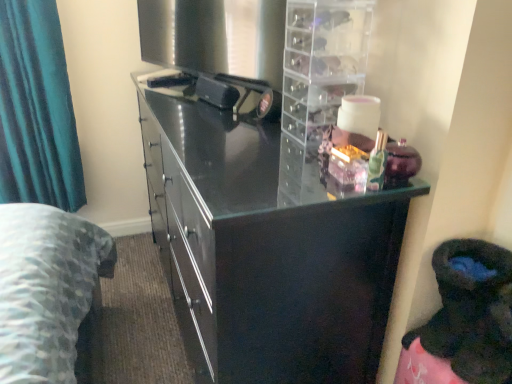
Describe the element at coordinates (266, 246) in the screenshot. I see `glossy black cupboard at center` at that location.

What do you see at coordinates (322, 63) in the screenshot? This screenshot has height=384, width=512. I see `clear plastic drawer unit at upper right` at bounding box center [322, 63].

Locate an element on the screen. teal fabric curtain at left is located at coordinates (37, 110).

From the image's perspective, which object appears higher, glossy black cupboard at center or clear plastic drawer unit at upper right?

clear plastic drawer unit at upper right is shown above in the image.

Could you tell me if glossy black cupboard at center is facing clear plastic drawer unit at upper right?

No, glossy black cupboard at center is not aimed at clear plastic drawer unit at upper right.

Consider the image. Looking at the image, does glossy black cupboard at center seem bigger or smaller compared to clear plastic drawer unit at upper right?

Clearly, glossy black cupboard at center is larger in size than clear plastic drawer unit at upper right.

Locate an element on the screen. cabinet that is above the glossy black cupboard at center (from the image's perspective) is located at coordinates (322, 63).

How different are the orientations of teal fabric curtain at left and glossy black cupboard at center in degrees?

There is a 88.5-degree angle between the facing directions of teal fabric curtain at left and glossy black cupboard at center.

Is glossy black cupboard at center at the back of teal fabric curtain at left?

That's not correct — teal fabric curtain at left is not looking away from glossy black cupboard at center.

Between teal fabric curtain at left and glossy black cupboard at center, which one is positioned in front?

glossy black cupboard at center is closer to the camera.

Can you confirm if clear plastic drawer unit at upper right is smaller than glossy black cupboard at center?

Correct, clear plastic drawer unit at upper right occupies less space than glossy black cupboard at center.

From the image's perspective, is clear plastic drawer unit at upper right above glossy black cupboard at center?

Yes, from the image's perspective, clear plastic drawer unit at upper right is over glossy black cupboard at center.

How much distance is there between clear plastic drawer unit at upper right and glossy black cupboard at center?

clear plastic drawer unit at upper right is 9.95 inches from glossy black cupboard at center.

Considering their positions, is clear plastic drawer unit at upper right located in front of or behind glossy black cupboard at center?

clear plastic drawer unit at upper right is positioned farther from the viewer than glossy black cupboard at center.

From a real-world perspective, is teal fabric curtain at left on clear plastic drawer unit at upper right?

Incorrect, from a real-world perspective, teal fabric curtain at left is lower than clear plastic drawer unit at upper right.

Considering their positions, is teal fabric curtain at left located in front of or behind clear plastic drawer unit at upper right?

teal fabric curtain at left is positioned farther from the viewer than clear plastic drawer unit at upper right.

Does teal fabric curtain at left have a lesser height compared to clear plastic drawer unit at upper right?

No.

Is teal fabric curtain at left surrounding clear plastic drawer unit at upper right?

No, teal fabric curtain at left does not contain clear plastic drawer unit at upper right.

Considering the sizes of objects glossy black cupboard at center and teal fabric curtain at left in the image provided, who is smaller, glossy black cupboard at center or teal fabric curtain at left?

Smaller between the two is teal fabric curtain at left.

Is glossy black cupboard at center positioned with its back to teal fabric curtain at left?

glossy black cupboard at center does not have its back to teal fabric curtain at left.

Does glossy black cupboard at center have a greater width compared to teal fabric curtain at left?

Indeed, glossy black cupboard at center has a greater width compared to teal fabric curtain at left.

Is clear plastic drawer unit at upper right directly adjacent to teal fabric curtain at left?

No, clear plastic drawer unit at upper right is not next to teal fabric curtain at left.

Which of these two, clear plastic drawer unit at upper right or teal fabric curtain at left, is thinner?

With smaller width is teal fabric curtain at left.

Considering the points (315, 3) and (21, 161), which point is in front, point (315, 3) or point (21, 161)?

The point (315, 3) is closer to the camera.

Identify the location of cupboard that appears on the left of clear plastic drawer unit at upper right. (266, 246).

Where is `cupboard located in front of the teal fabric curtain at left`? This screenshot has height=384, width=512. cupboard located in front of the teal fabric curtain at left is located at coordinates (266, 246).

Based on their spatial positions, is clear plastic drawer unit at upper right or teal fabric curtain at left further from glossy black cupboard at center?

teal fabric curtain at left is positioned further to the anchor glossy black cupboard at center.

Estimate the real-world distances between objects in this image. Which object is closer to teal fabric curtain at left, glossy black cupboard at center or clear plastic drawer unit at upper right?

The object closer to teal fabric curtain at left is glossy black cupboard at center.

When comparing their distances from glossy black cupboard at center, does teal fabric curtain at left or clear plastic drawer unit at upper right seem closer?

clear plastic drawer unit at upper right lies closer to glossy black cupboard at center than the other object.

Estimate the real-world distances between objects in this image. Which object is further from teal fabric curtain at left, clear plastic drawer unit at upper right or glossy black cupboard at center?

clear plastic drawer unit at upper right is further to teal fabric curtain at left.

Looking at the image, which one is located closer to clear plastic drawer unit at upper right, glossy black cupboard at center or teal fabric curtain at left?

glossy black cupboard at center is positioned closer to the anchor clear plastic drawer unit at upper right.

Looking at this image, based on their spatial positions, is teal fabric curtain at left or glossy black cupboard at center closer to clear plastic drawer unit at upper right?

Based on the image, glossy black cupboard at center appears to be nearer to clear plastic drawer unit at upper right.

This screenshot has width=512, height=384. In order to click on cupboard situated between teal fabric curtain at left and clear plastic drawer unit at upper right from left to right in this screenshot , I will do `click(266, 246)`.